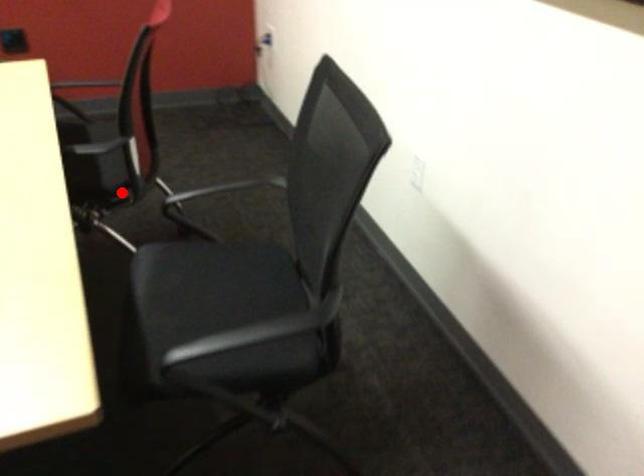
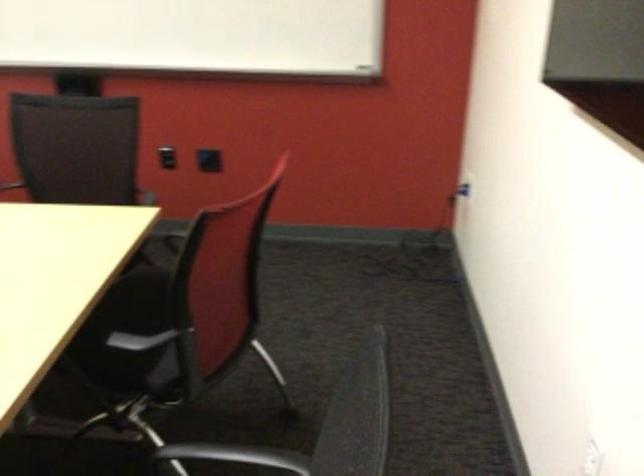
Where in the second image is the point corresponding to the highlighted location from the first image?

(169, 381)